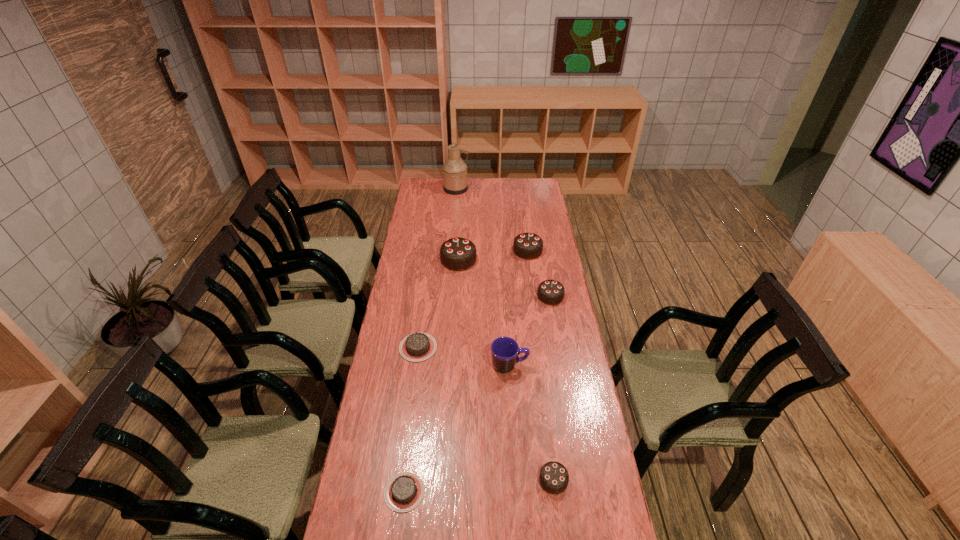
At what (x,y) coordinates should I click in order to perform the action: click on vacant space situated 0.120m on the back of the second shortest chocolate cake. Please return your answer as a coordinate pair (x, y). The image size is (960, 540). Looking at the image, I should click on (422, 313).

The height and width of the screenshot is (540, 960). In order to click on free space located 0.220m on the back of the shortest chocolate cake in this screenshot , I will do `click(415, 410)`.

Locate an element on the screen. This screenshot has width=960, height=540. object located at the far edge is located at coordinates (454, 171).

This screenshot has width=960, height=540. Identify the location of blank space at the far edge of the desktop. (493, 186).

At what (x,y) coordinates should I click in order to perform the action: click on vacant space at the left edge of the desktop. Please return your answer as a coordinate pair (x, y). Looking at the image, I should click on (345, 531).

Where is `free region at the right edge`? This screenshot has height=540, width=960. free region at the right edge is located at coordinates (565, 393).

This screenshot has height=540, width=960. In order to click on unoccupied area between the second shortest object and the mug in this screenshot , I will do `click(464, 356)`.

At what (x,y) coordinates should I click in order to perform the action: click on empty space between the black mug and the pitcher. Please return your answer as a coordinate pair (x, y). This screenshot has width=960, height=540. Looking at the image, I should click on (483, 277).

What are the coordinates of `free spot between the smaller brown chocolate cake and the smallest chocolate chocolate cake` in the screenshot? It's located at (479, 486).

You are a GUI agent. You are given a task and a screenshot of the screen. Output one action in this format:
    pyautogui.click(x=<x>, y=<y>)
    Task: Click on the free area in between the seventh tallest object and the black mug
    
    Given the screenshot: What is the action you would take?
    pyautogui.click(x=464, y=356)